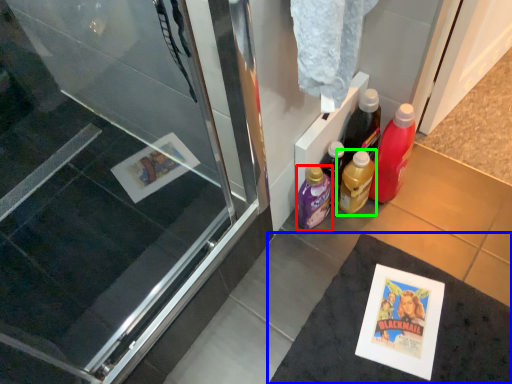
Question: Which object is the closest to the bottle (highlighted by a red box)? Choose among these: bath mat (highlighted by a blue box) or bottle (highlighted by a green box).

Choices:
 (A) bath mat
 (B) bottle

Answer: (B)